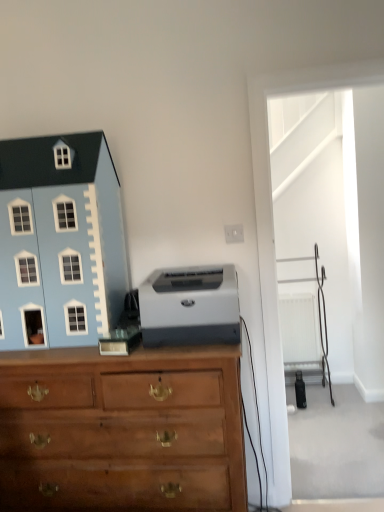
Question: Considering the relative positions of light blue plastic toy house at left and gray matte printer at center in the image provided, is light blue plastic toy house at left to the left of gray matte printer at center from the viewer's perspective?

Choices:
 (A) no
 (B) yes

Answer: (B)

Question: Can you confirm if light blue plastic toy house at left is positioned to the right of gray matte printer at center?

Choices:
 (A) no
 (B) yes

Answer: (A)

Question: Would you say light blue plastic toy house at left contains gray matte printer at center?

Choices:
 (A) no
 (B) yes

Answer: (A)

Question: Is light blue plastic toy house at left thinner than gray matte printer at center?

Choices:
 (A) yes
 (B) no

Answer: (A)

Question: Would you say light blue plastic toy house at left is outside gray matte printer at center?

Choices:
 (A) yes
 (B) no

Answer: (A)

Question: Considering the relative sizes of light blue plastic toy house at left and gray matte printer at center in the image provided, is light blue plastic toy house at left bigger than gray matte printer at center?

Choices:
 (A) no
 (B) yes

Answer: (B)

Question: Is the surface of gray matte printer at center in direct contact with white plastic radiator at right?

Choices:
 (A) no
 (B) yes

Answer: (A)

Question: Could white plastic radiator at right be considered to be inside gray matte printer at center?

Choices:
 (A) no
 (B) yes

Answer: (A)

Question: Would you say gray matte printer at center is outside white plastic radiator at right?

Choices:
 (A) no
 (B) yes

Answer: (B)

Question: Is gray matte printer at center at the right side of white plastic radiator at right?

Choices:
 (A) yes
 (B) no

Answer: (B)

Question: Is the depth of gray matte printer at center greater than that of white plastic radiator at right?

Choices:
 (A) no
 (B) yes

Answer: (A)

Question: Does gray matte printer at center have a lesser height compared to white plastic radiator at right?

Choices:
 (A) yes
 (B) no

Answer: (A)

Question: Is wooden chest of drawers at center wider than light blue plastic toy house at left?

Choices:
 (A) no
 (B) yes

Answer: (B)